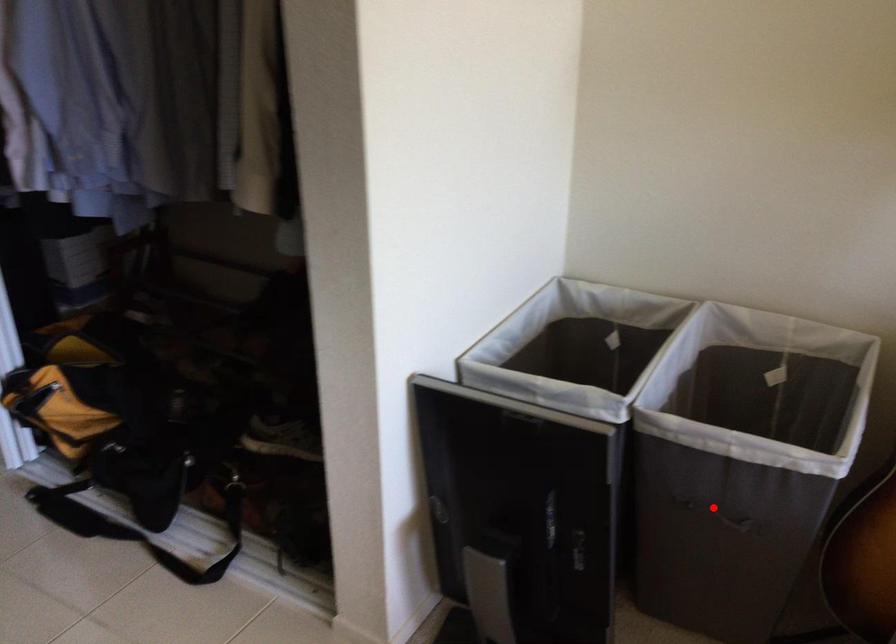
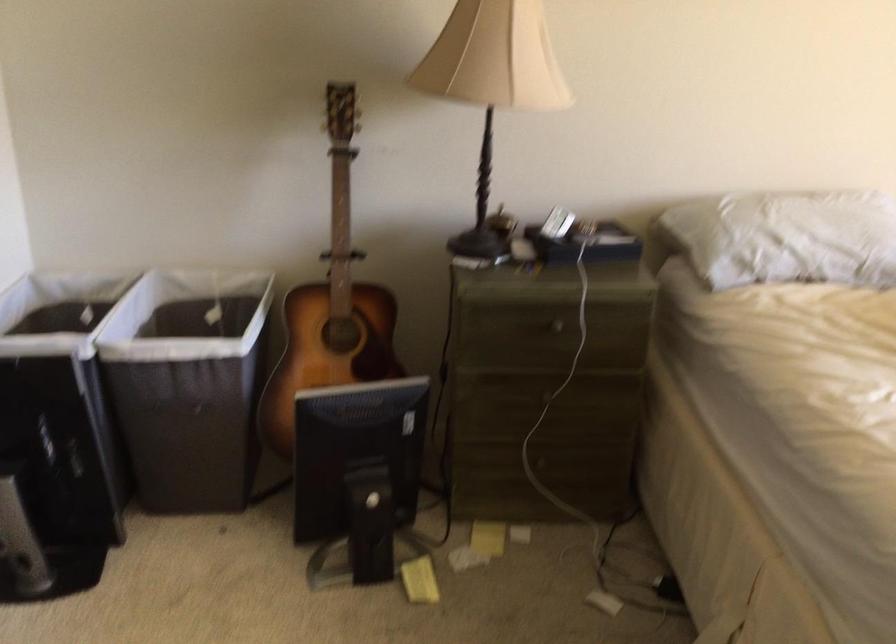
Find the pixel in the second image that matches the highlighted location in the first image.

(181, 406)